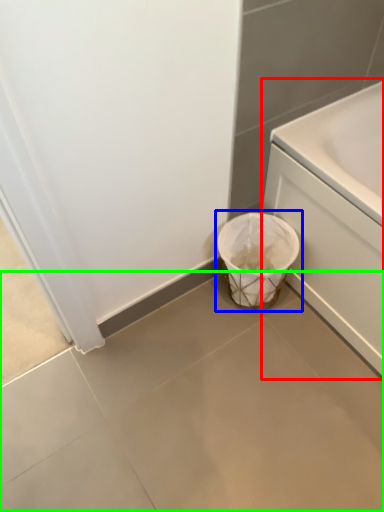
Question: Based on their relative distances, which object is nearer to bath (highlighted by a red box)? Choose from waste container (highlighted by a blue box) and concrete (highlighted by a green box).

Choices:
 (A) waste container
 (B) concrete

Answer: (A)